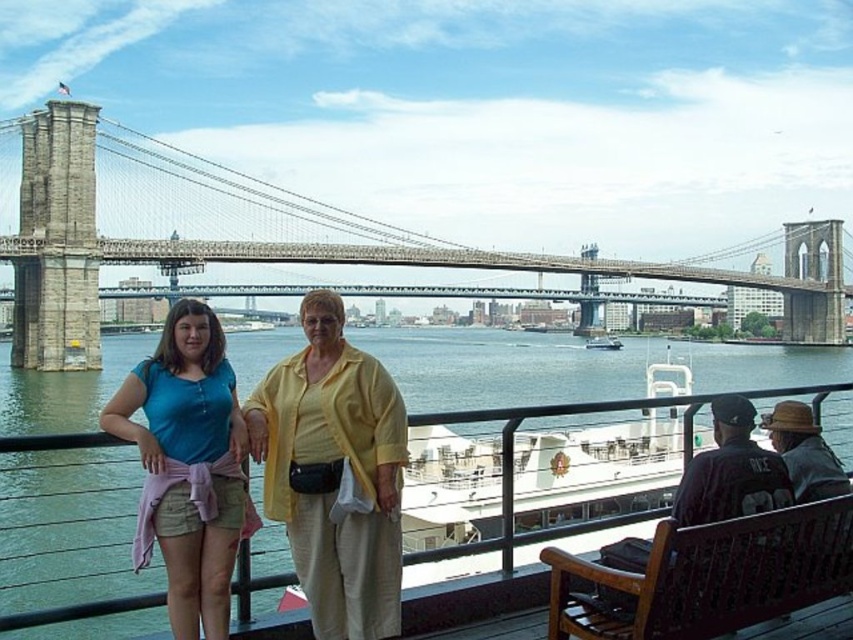
You are a photographer trying to capture a shot of the matte yellow blouse at center and the stone suspension bridge at center. Based on their positions, which object is closer to the camera?

The matte yellow blouse at center is positioned under the stone suspension bridge at center, meaning it is closer to the camera.

You are a photographer standing at the waterfront promenade. You want to capture a photo of the stone suspension bridge at center while ensuring the matte yellow blouse at center is visible in the foreground. Given that your camera has a maximum focus range of 100 meters, will you be able to capture both subjects clearly in one shot?

The distance between the matte yellow blouse at center and the stone suspension bridge at center is 83.01 meters. Since your camera can focus up to 100 meters, the 83.01 meters distance is within the range. Therefore, you can capture both subjects clearly in one shot.

You are a photographer trying to capture a photo of the matte yellow blouse at center and the stone suspension bridge at center. Based on their sizes in the image, which object would you focus on first to ensure it is sharp and in focus?

The stone suspension bridge at center occupies more space than the matte yellow blouse at center, so you should focus on the stone suspension bridge at center first to ensure it is sharp and in focus.